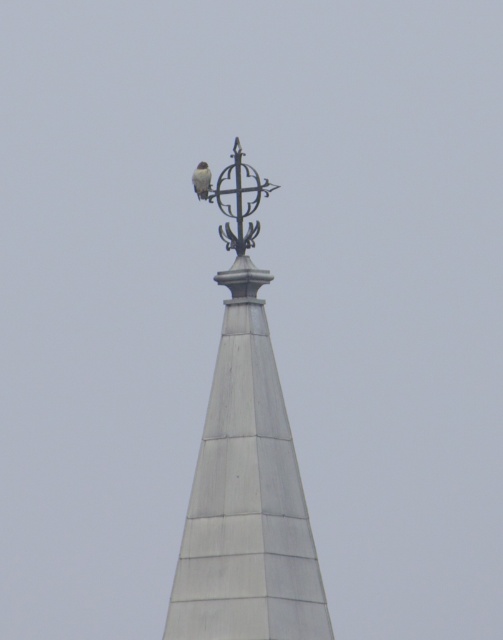
Question: Does white matte spire at upper center lie behind white feathered bird at upper center?

Choices:
 (A) yes
 (B) no

Answer: (B)

Question: Among these objects, which one is farthest from the camera?

Choices:
 (A) white feathered bird at upper center
 (B) white matte spire at upper center

Answer: (A)

Question: Can you confirm if white matte spire at upper center is smaller than white feathered bird at upper center?

Choices:
 (A) yes
 (B) no

Answer: (B)

Question: Can you confirm if white matte spire at upper center is thinner than white feathered bird at upper center?

Choices:
 (A) no
 (B) yes

Answer: (A)